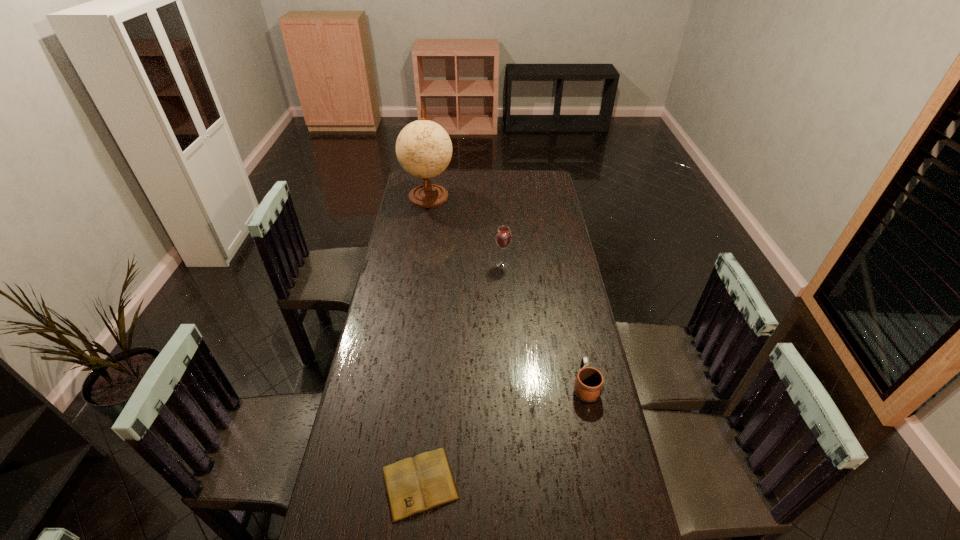
Where is `vacant space located 0.380m on the side of the mug with the handle`? Image resolution: width=960 pixels, height=540 pixels. vacant space located 0.380m on the side of the mug with the handle is located at coordinates (565, 290).

Locate an element on the screen. Image resolution: width=960 pixels, height=540 pixels. vacant region located on the side of the mug with the handle is located at coordinates (573, 330).

I want to click on free space located on the side of the mug with the handle, so click(x=571, y=321).

Where is `vacant space located on the right of the book`? The image size is (960, 540). vacant space located on the right of the book is located at coordinates (501, 483).

Where is `object that is at the far edge`? Image resolution: width=960 pixels, height=540 pixels. object that is at the far edge is located at coordinates (423, 148).

Image resolution: width=960 pixels, height=540 pixels. I want to click on globe located in the left edge section of the desktop, so click(x=423, y=148).

Locate an element on the screen. book at the left edge is located at coordinates (413, 485).

At what (x,y) coordinates should I click in order to perform the action: click on object that is positioned at the right edge. Please return your answer as a coordinate pair (x, y). Image resolution: width=960 pixels, height=540 pixels. Looking at the image, I should click on (589, 382).

Where is `object that is at the far left corner`? This screenshot has height=540, width=960. object that is at the far left corner is located at coordinates (423, 148).

What are the coordinates of `vacant space at the far edge of the desktop` in the screenshot? It's located at (451, 179).